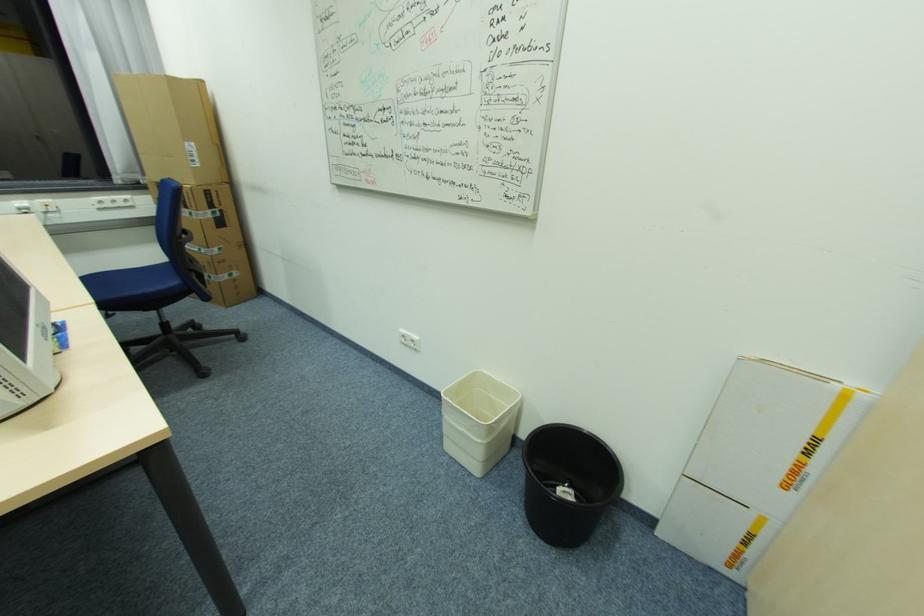
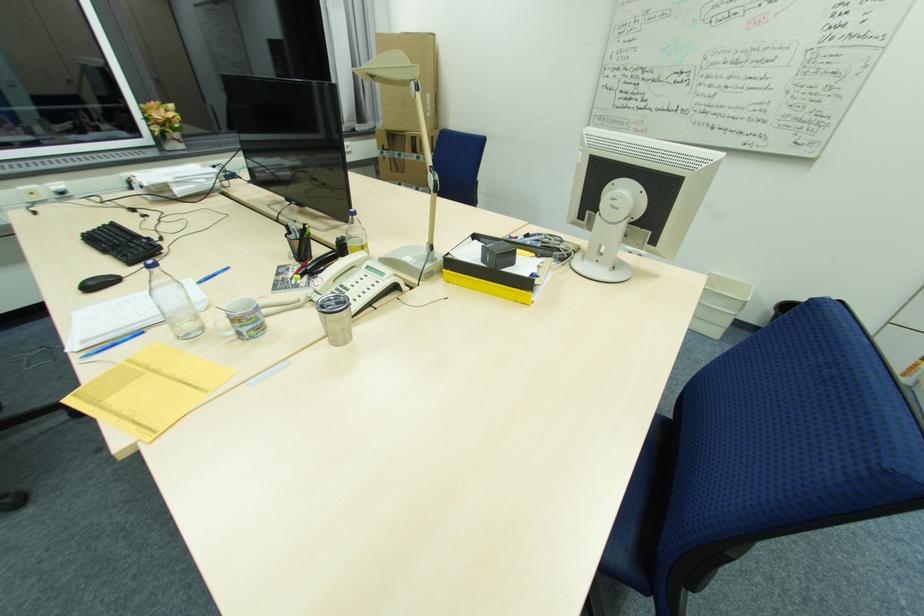
Which direction would the cameraman need to move to produce the second image?

The cameraman walked toward left, backward.